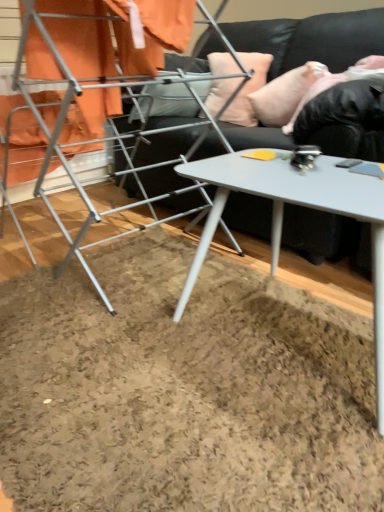
Question: Is white glossy table at center looking in the opposite direction of metallic silver drying rack at left?

Choices:
 (A) no
 (B) yes

Answer: (A)

Question: From the image's perspective, is white glossy table at center on top of metallic silver drying rack at left?

Choices:
 (A) no
 (B) yes

Answer: (A)

Question: Considering the relative sizes of white glossy table at center and metallic silver drying rack at left in the image provided, is white glossy table at center wider than metallic silver drying rack at left?

Choices:
 (A) yes
 (B) no

Answer: (B)

Question: Does white glossy table at center have a greater height compared to metallic silver drying rack at left?

Choices:
 (A) yes
 (B) no

Answer: (B)

Question: Is white glossy table at center thinner than metallic silver drying rack at left?

Choices:
 (A) yes
 (B) no

Answer: (A)

Question: Is the surface of white glossy table at center in direct contact with metallic silver drying rack at left?

Choices:
 (A) no
 (B) yes

Answer: (A)

Question: Would you say white glossy table at center contains black soft fur at upper right?

Choices:
 (A) no
 (B) yes

Answer: (A)

Question: Can you confirm if white glossy table at center is positioned to the right of black soft fur at upper right?

Choices:
 (A) no
 (B) yes

Answer: (A)

Question: Does white glossy table at center have a greater height compared to black soft fur at upper right?

Choices:
 (A) yes
 (B) no

Answer: (A)

Question: Is white glossy table at center not near black soft fur at upper right?

Choices:
 (A) yes
 (B) no

Answer: (B)

Question: Is white glossy table at center positioned behind black soft fur at upper right?

Choices:
 (A) yes
 (B) no

Answer: (B)

Question: From the image's perspective, is white glossy table at center located beneath black soft fur at upper right?

Choices:
 (A) yes
 (B) no

Answer: (A)

Question: Is black leather couch at upper center aimed at pink fabric pillow at upper right, marked as the 1th pillow in a right-to-left arrangement?

Choices:
 (A) no
 (B) yes

Answer: (B)